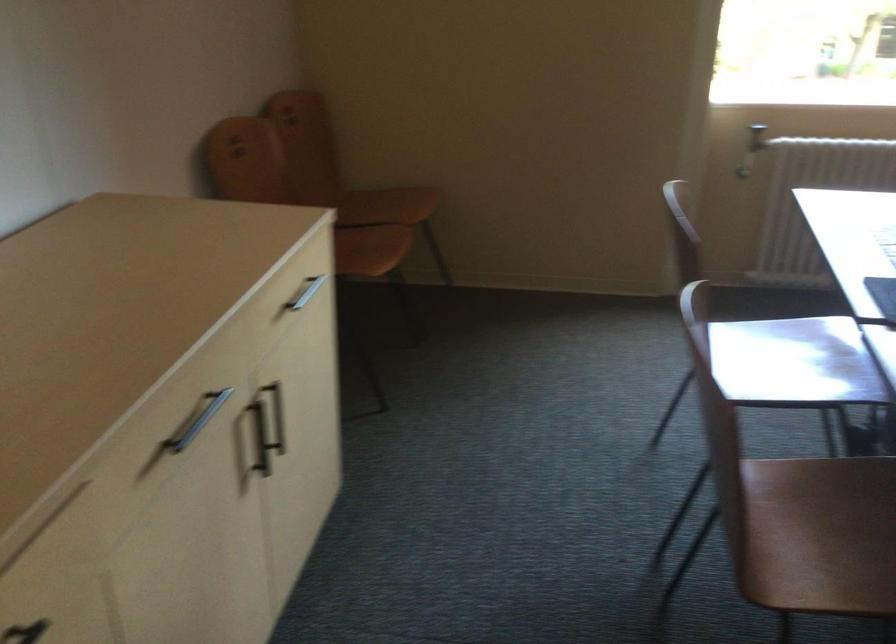
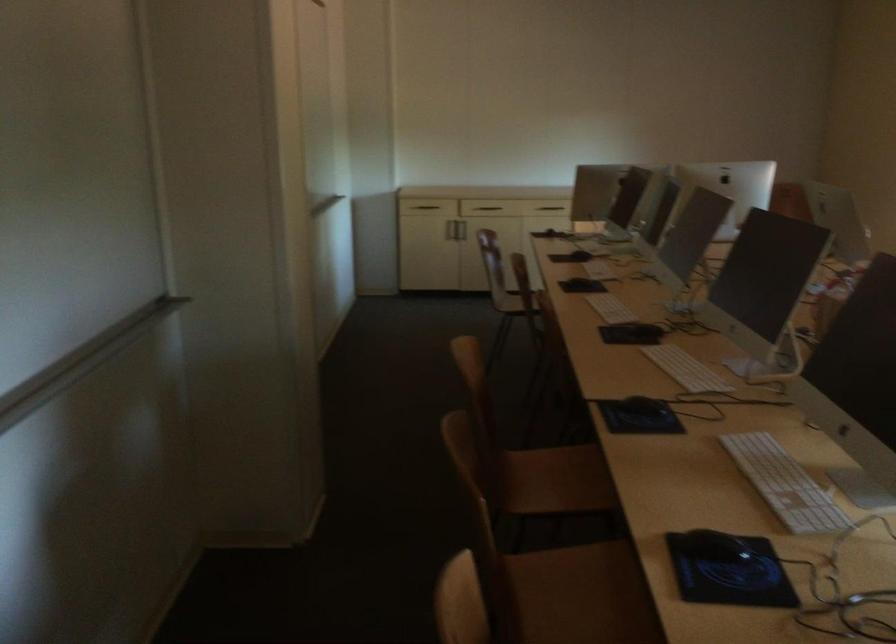
Question: I am providing you with two images of the same scene from different viewpoints. After the viewpoint changes to image2, which objects are now occluded?

Choices:
 (A) white shelf hook
 (B) white computer keyboard
 (C) metal cabinet handle
 (D) brown chair sitting surface

Answer: (D)